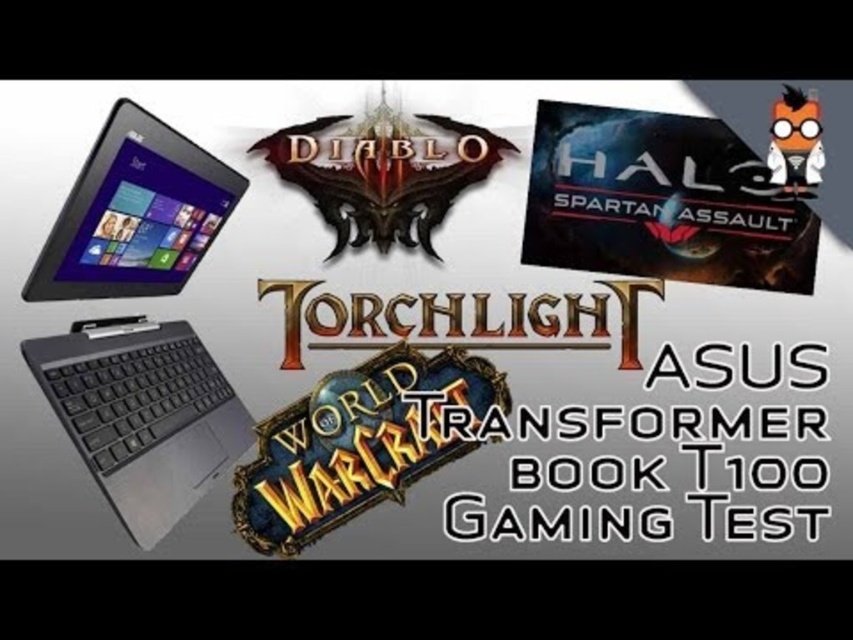
Who is lower down, black matte asus transformer book t100 at left or matte black tablet at left?

black matte asus transformer book t100 at left is lower down.

Is black matte asus transformer book t100 at left further to camera compared to matte black tablet at left?

No, it is in front of matte black tablet at left.

Who is more forward, [51,276] or [148,214]?

Positioned in front is point [51,276].

Locate an element on the screen. The height and width of the screenshot is (640, 853). black matte asus transformer book t100 at left is located at coordinates (x=142, y=413).